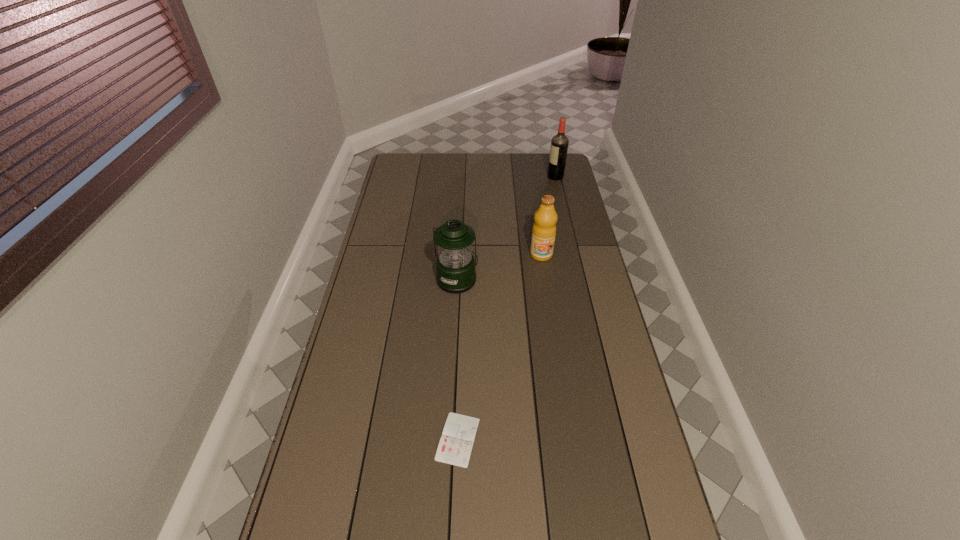
Image resolution: width=960 pixels, height=540 pixels. I want to click on vacant point located 0.400m on the front label of the second farthest object, so click(x=555, y=343).

Identify the location of vacant position located 0.170m on the back of the second nearest object. This screenshot has height=540, width=960. (460, 237).

What are the coordinates of `free spot located on the front of the shortest object` in the screenshot? It's located at pyautogui.click(x=455, y=509).

The width and height of the screenshot is (960, 540). What are the coordinates of `object located in the far edge section of the desktop` in the screenshot? It's located at (559, 144).

The width and height of the screenshot is (960, 540). In order to click on liquor at the right edge in this screenshot , I will do [559, 144].

Image resolution: width=960 pixels, height=540 pixels. What are the coordinates of `fruit juice present at the right edge` in the screenshot? It's located at [544, 228].

Where is `object that is at the far right corner`? The width and height of the screenshot is (960, 540). object that is at the far right corner is located at coordinates (559, 144).

The image size is (960, 540). Identify the location of vacant space at the far edge of the desktop. [431, 157].

At what (x,y) coordinates should I click in order to perform the action: click on vacant space at the left edge of the desktop. Please return your answer as a coordinate pair (x, y). The width and height of the screenshot is (960, 540). Looking at the image, I should click on (408, 251).

I want to click on vacant area at the right edge of the desktop, so click(x=645, y=500).